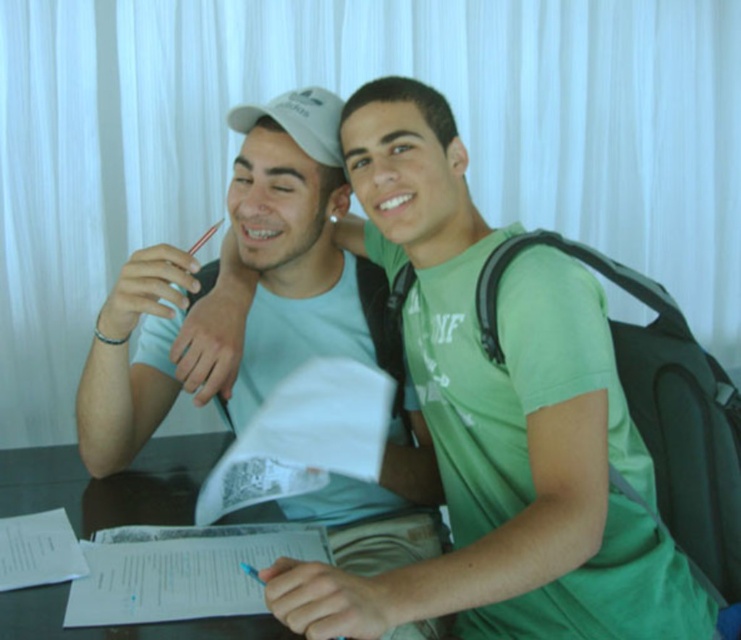
Question: Which point is farther from the camera taking this photo?

Choices:
 (A) (408, 406)
 (B) (64, 500)

Answer: (A)

Question: Which point is farther to the camera?

Choices:
 (A) transparent glass table at center
 (B) matte white cap at upper left

Answer: (B)

Question: Can you confirm if matte white cap at upper left is wider than transparent glass table at center?

Choices:
 (A) no
 (B) yes

Answer: (A)

Question: Does matte white cap at upper left come behind transparent glass table at center?

Choices:
 (A) yes
 (B) no

Answer: (A)

Question: Among these points, which one is nearest to the camera?

Choices:
 (A) click(156, 449)
 (B) click(332, 336)

Answer: (B)

Question: Is matte white cap at upper left to the left of transparent glass table at center from the viewer's perspective?

Choices:
 (A) yes
 (B) no

Answer: (B)